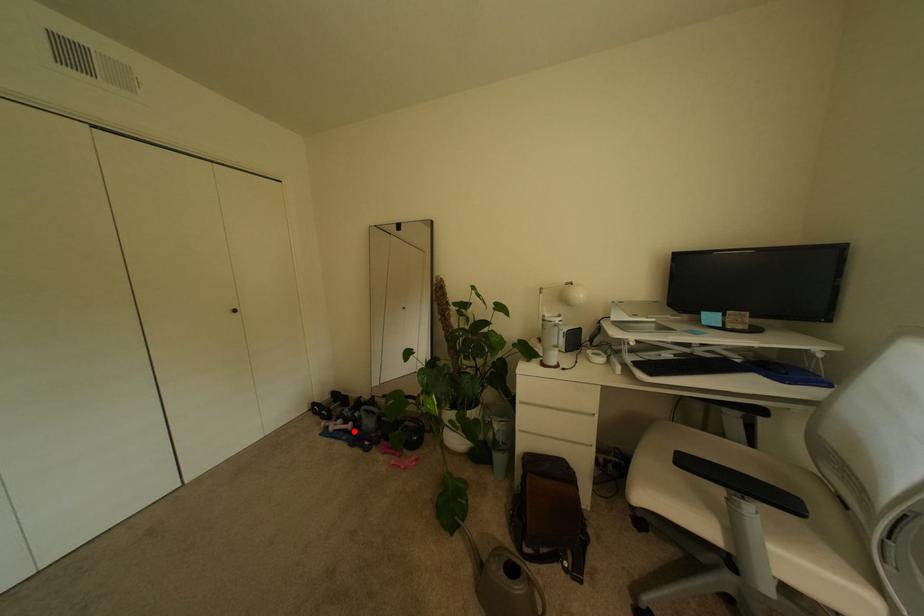
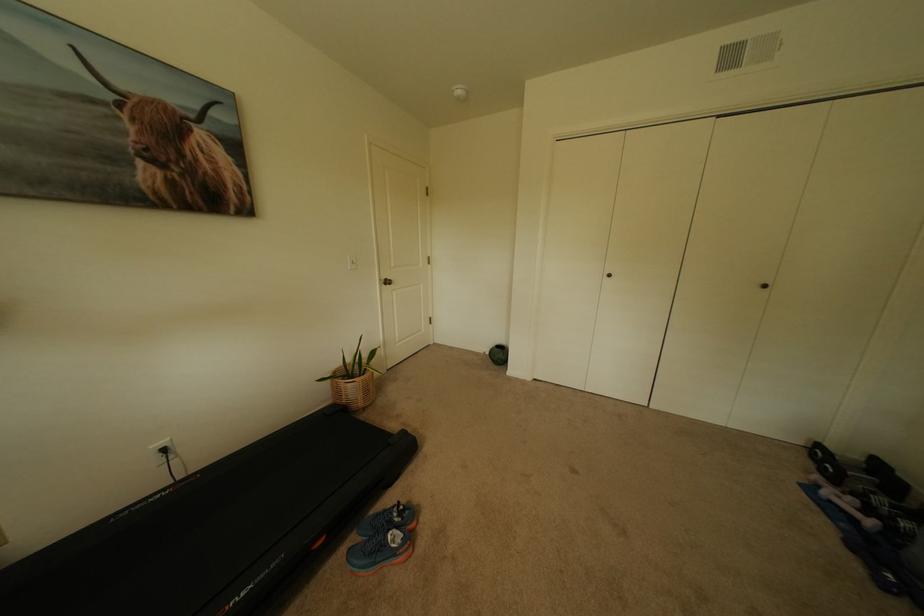
Locate, in the second image, the point that corresponds to the highlighted location in the first image.

(862, 521)